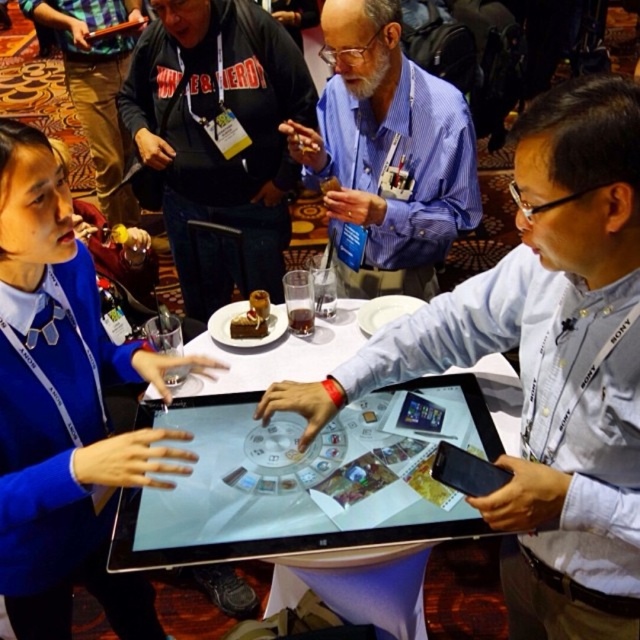
Question: Which point is closer to the camera taking this photo?

Choices:
 (A) (464, 362)
 (B) (116, 113)

Answer: (A)

Question: Observing the image, what is the correct spatial positioning of blue shirt at center in reference to black glossy tablet at center?

Choices:
 (A) left
 (B) right

Answer: (A)

Question: Can you confirm if silver glossy tablet at center is smaller than black glossy tablet at center?

Choices:
 (A) yes
 (B) no

Answer: (B)

Question: Is the position of silver glossy tablet at center less distant than that of brushed metal jacket at upper center?

Choices:
 (A) yes
 (B) no

Answer: (A)

Question: Considering the real-world distances, which object is farthest from the blue fabric sweater at center?

Choices:
 (A) blue shirt at center
 (B) black glossy tablet at center
 (C) matte black hoodie at upper left
 (D) white glossy tablet at center

Answer: (C)

Question: Which point appears closest to the camera in this image?

Choices:
 (A) (438, 456)
 (B) (445, 83)

Answer: (A)